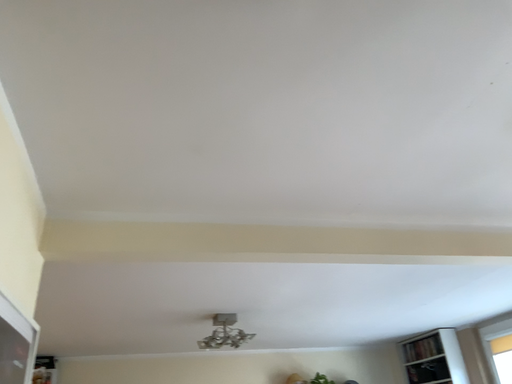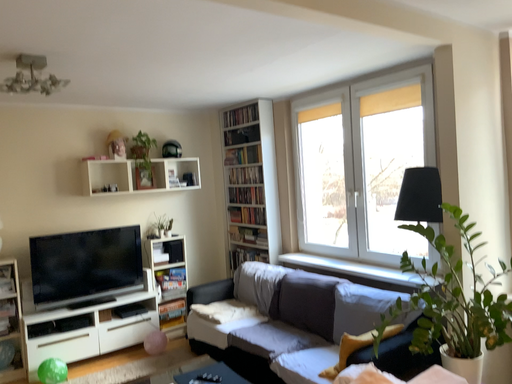
Question: How did the camera likely rotate when shooting the video?

Choices:
 (A) rotated right
 (B) rotated left

Answer: (A)